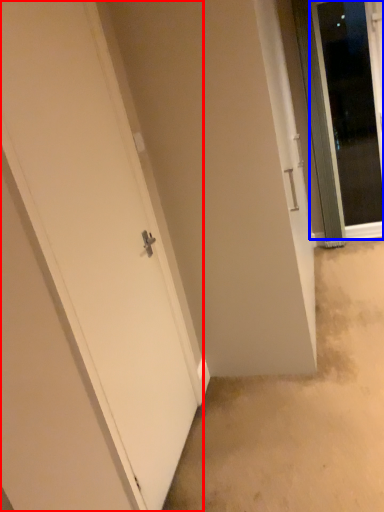
Question: Among these objects, which one is farthest to the camera, door (highlighted by a red box) or door (highlighted by a blue box)?

Choices:
 (A) door
 (B) door

Answer: (B)